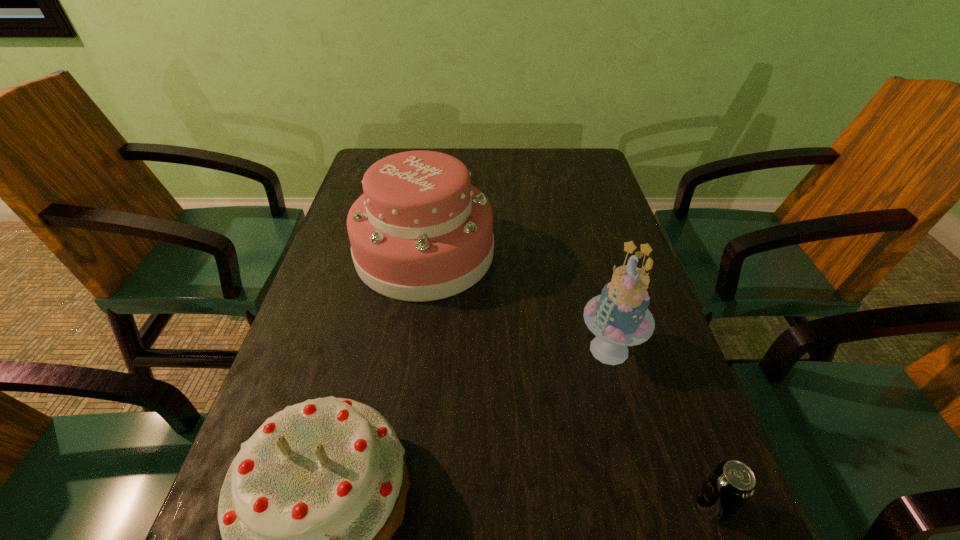
In order to click on the second farthest cake in this screenshot , I will do pyautogui.click(x=619, y=317).

Find the location of `the third object from left to right`. the third object from left to right is located at coordinates (619, 317).

You are a GUI agent. You are given a task and a screenshot of the screen. Output one action in this format:
    pyautogui.click(x=<x>, y=<y>)
    Task: Click on the farthest object
    
    Given the screenshot: What is the action you would take?
    (420, 231)

Where is `the shortest object`? The height and width of the screenshot is (540, 960). the shortest object is located at coordinates (732, 483).

Identify the location of soda can. The height and width of the screenshot is (540, 960). (732, 483).

What are the coordinates of `free space located 0.290m with a ladder on the side of the rightmost cake` in the screenshot? It's located at (430, 349).

Locate an element on the screen. free spot located with a ladder on the side of the rightmost cake is located at coordinates (541, 349).

You are a GUI agent. You are given a task and a screenshot of the screen. Output one action in this format:
    pyautogui.click(x=<x>, y=<y>)
    Task: Click on the free space located with a ladder on the side of the rightmost cake
    Image resolution: width=960 pixels, height=540 pixels.
    Given the screenshot: What is the action you would take?
    pyautogui.click(x=461, y=349)

Where is `vacant space located 0.320m on the back of the farthest cake`? The width and height of the screenshot is (960, 540). vacant space located 0.320m on the back of the farthest cake is located at coordinates (439, 157).

The image size is (960, 540). Identify the location of vacant area situated 0.190m on the left of the shortest object. (568, 506).